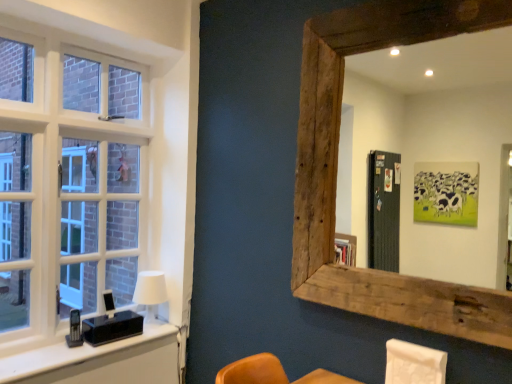
Find the location of a particular element. The image size is (512, 384). vacant point above black plastic vanity at left (from a real-world perspective) is located at coordinates (64, 354).